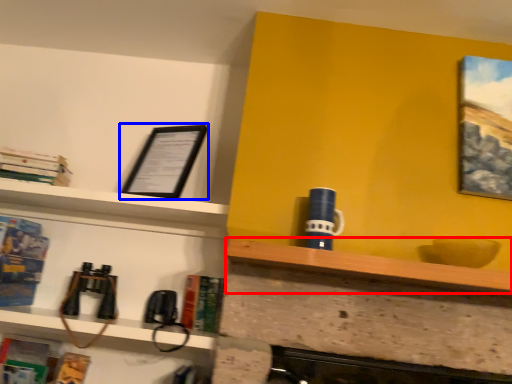
Question: Which object is further to the camera taking this photo, shelf (highlighted by a red box) or picture frame (highlighted by a blue box)?

Choices:
 (A) shelf
 (B) picture frame

Answer: (B)